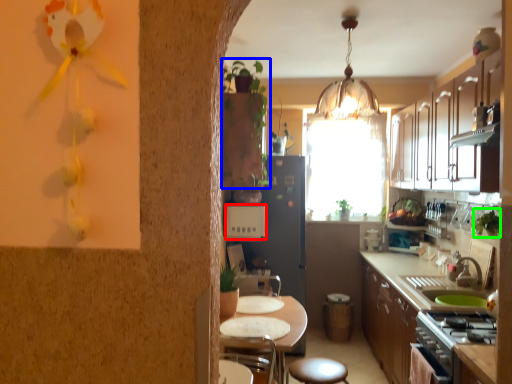
Question: Considering the real-world distances, which object is closest to appliance (highlighted by a red box)? plant (highlighted by a blue box) or plant (highlighted by a green box).

Choices:
 (A) plant
 (B) plant

Answer: (A)